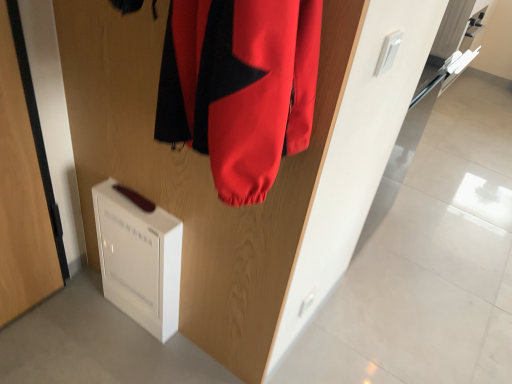
Where is `vacant space in front of white plastic air purifier at lower left`? vacant space in front of white plastic air purifier at lower left is located at coordinates (120, 340).